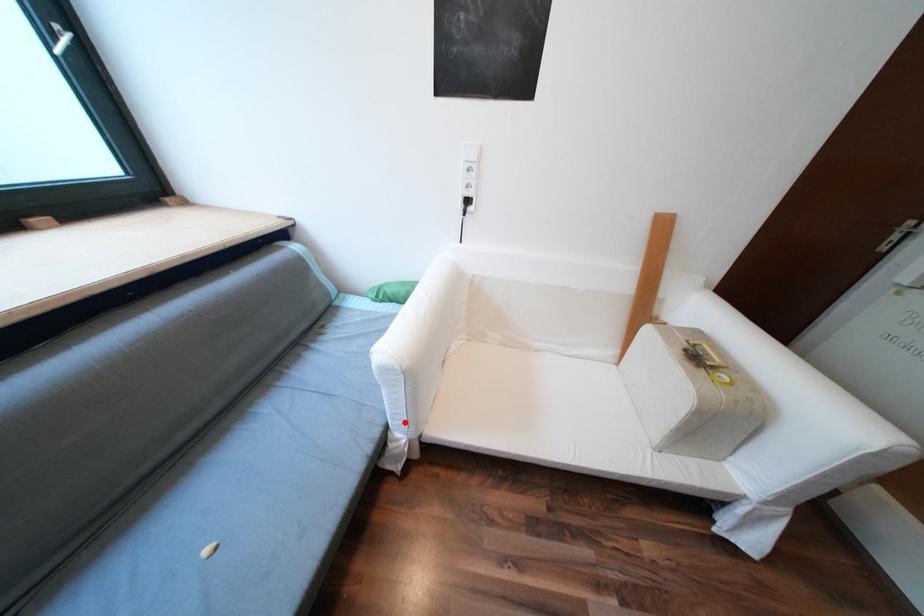
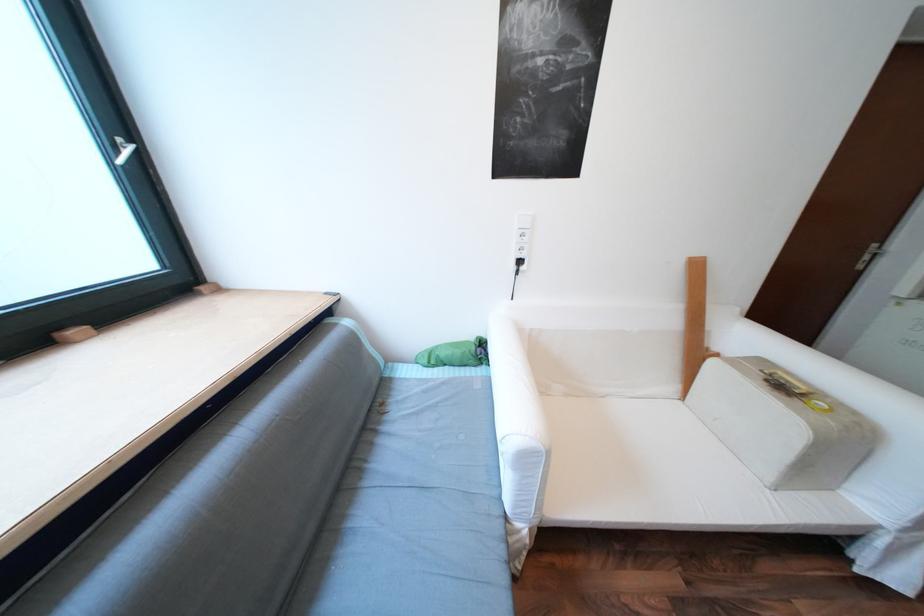
Question: I am providing you with two images of the same scene from different viewpoints. In image1, a red point is highlighted. Considering the same 3D point in image2, which of the following is correct?

Choices:
 (A) It is closer
 (B) It is farther

Answer: (A)